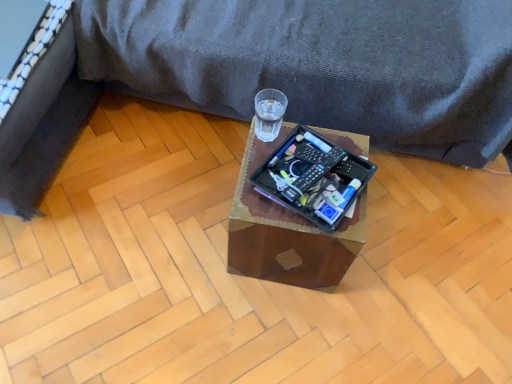
Where is `free space to the left of black plastic remote control at center`? This screenshot has height=384, width=512. free space to the left of black plastic remote control at center is located at coordinates (253, 182).